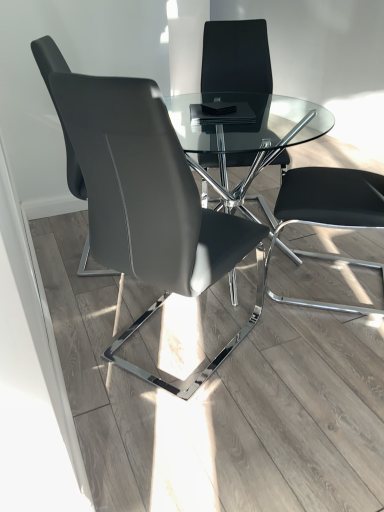
This screenshot has width=384, height=512. I want to click on vacant space in front of matte black chair at left, the 2th chair viewed from the front, so click(x=91, y=302).